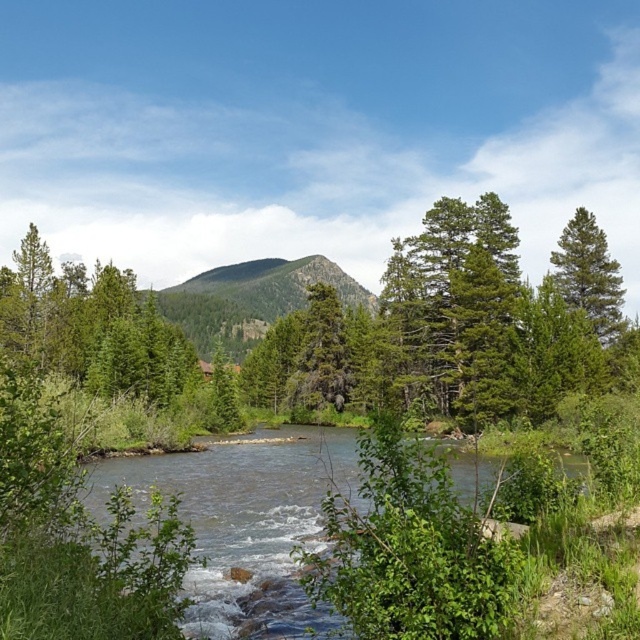
Question: Is clear water at center wider than green matte tree at right?

Choices:
 (A) no
 (B) yes

Answer: (B)

Question: Does green textured mountain at center have a smaller size compared to green matte tree at right?

Choices:
 (A) no
 (B) yes

Answer: (A)

Question: Which point appears closest to the camera in this image?

Choices:
 (A) click(221, 317)
 (B) click(248, 556)
 (C) click(609, 292)

Answer: (B)

Question: Which point is farther from the camera taking this photo?

Choices:
 (A) (246, 532)
 (B) (216, 321)
 (C) (584, 214)

Answer: (B)

Question: Which of these objects is positioned farthest from the green matte tree at right?

Choices:
 (A) clear water at center
 (B) green textured mountain at center

Answer: (B)

Question: Does clear water at center come behind green textured mountain at center?

Choices:
 (A) yes
 (B) no

Answer: (B)